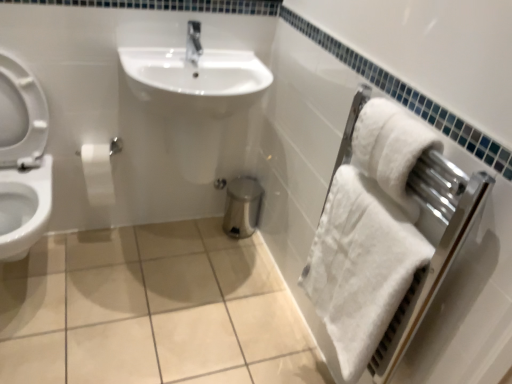
Find the location of a particular element. vacant area to the left of satin nickel faucet at center is located at coordinates [x=156, y=55].